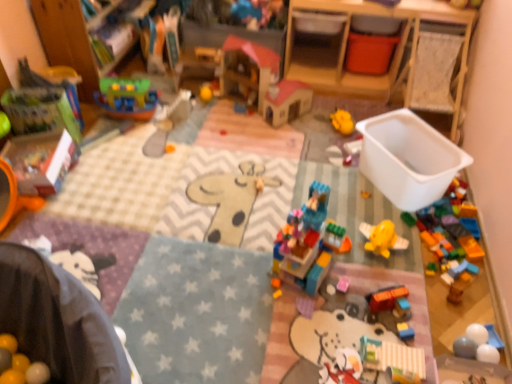
The image size is (512, 384). I want to click on free spot in front of wooden dollhouse at center, which is counted as the 9th toy, starting from the bottom, so click(x=260, y=140).